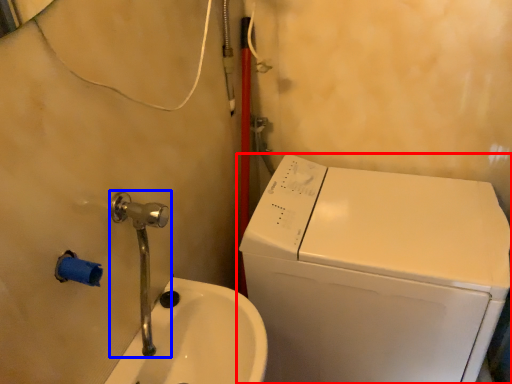
Question: Which object is closer to the camera taking this photo, washing machine (highlighted by a red box) or plumbing fixture (highlighted by a blue box)?

Choices:
 (A) washing machine
 (B) plumbing fixture

Answer: (B)